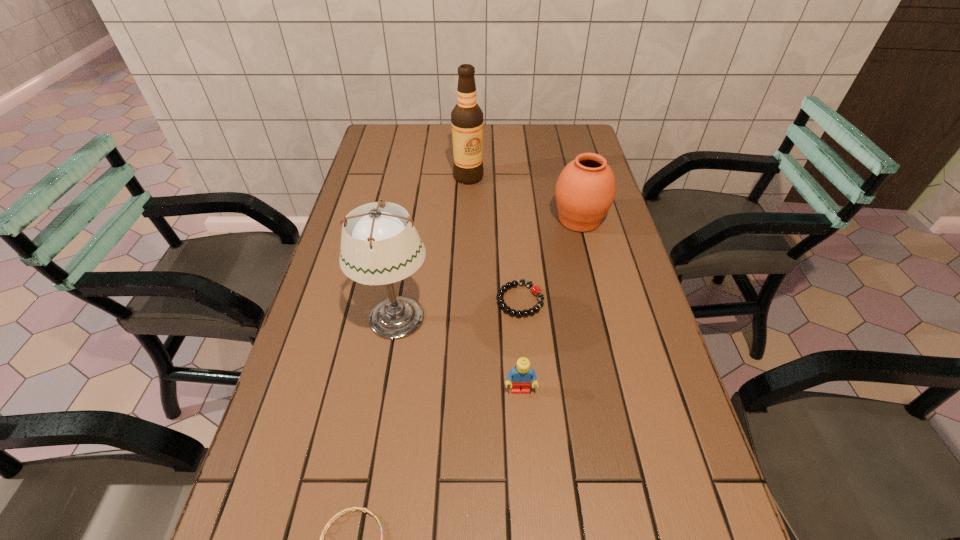
At what (x,y) coordinates should I click in order to perform the action: click on vacant area between the third tallest object and the farthest object. Please return your answer as a coordinate pair (x, y). Image resolution: width=960 pixels, height=540 pixels. Looking at the image, I should click on (524, 198).

This screenshot has height=540, width=960. What are the coordinates of `free space between the taller bracelet and the fourth shortest object` in the screenshot? It's located at (550, 260).

Find the location of a particular element. This screenshot has width=960, height=540. free space between the second shortest object and the lampshade is located at coordinates (458, 309).

The image size is (960, 540). I want to click on empty space between the fifth tallest object and the farthest object, so click(494, 239).

The image size is (960, 540). Identify the location of vacant space that's between the fourth shortest object and the lampshade. (488, 269).

Image resolution: width=960 pixels, height=540 pixels. Find the location of `free spot between the Lego and the right bracelet`. free spot between the Lego and the right bracelet is located at coordinates (520, 345).

At what (x,y) coordinates should I click in order to perform the action: click on unoccupied area between the second nearest object and the farthest object. Please return your answer as a coordinate pair (x, y). The height and width of the screenshot is (540, 960). Looking at the image, I should click on (494, 284).

You are a GUI agent. You are given a task and a screenshot of the screen. Output one action in this format:
    pyautogui.click(x=<x>, y=<y>)
    Task: Click on the blank region between the lampshade and the urn
    The height and width of the screenshot is (540, 960).
    Given the screenshot: What is the action you would take?
    pyautogui.click(x=488, y=269)

Identify the location of unoccupied area between the third shortest object and the taller bracelet. This screenshot has height=540, width=960. (520, 345).

This screenshot has height=540, width=960. Identify the location of object that is the fifth closest one to the fifth nearest object. (342, 512).